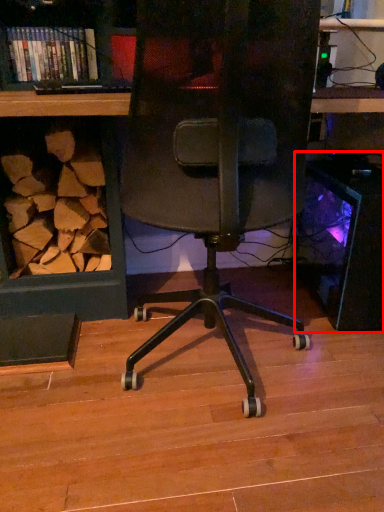
Question: Observing the image, what is the correct spatial positioning of desktop computer (annotated by the red box) in reference to book?

Choices:
 (A) left
 (B) right

Answer: (B)